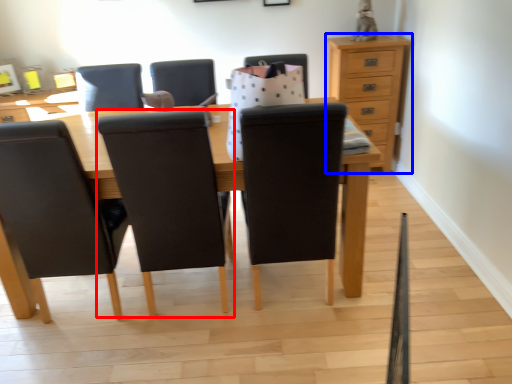
Question: Which of the following is the closest to the observer, chair (highlighted by a red box) or chest of drawers (highlighted by a blue box)?

Choices:
 (A) chair
 (B) chest of drawers

Answer: (A)